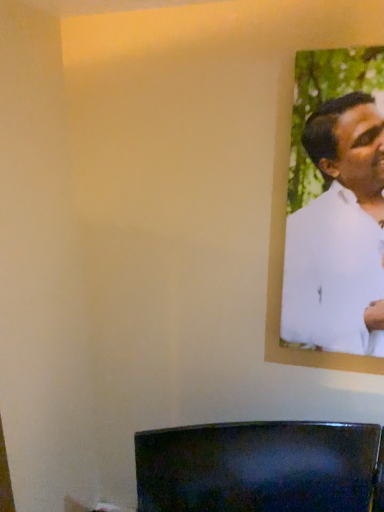
Question: Which is correct: glossy black tv at lower center is inside white matte shirt at upper right, or outside of it?

Choices:
 (A) outside
 (B) inside

Answer: (A)

Question: Based on their sizes in the image, would you say glossy black tv at lower center is bigger or smaller than white matte shirt at upper right?

Choices:
 (A) small
 (B) big

Answer: (B)

Question: Relative to white matte shirt at upper right, is glossy black tv at lower center in front or behind?

Choices:
 (A) front
 (B) behind

Answer: (B)

Question: Relative to glossy black tv at lower center, is white matte shirt at upper right in front or behind?

Choices:
 (A) front
 (B) behind

Answer: (A)

Question: In the image, is white matte shirt at upper right on the left side or the right side of glossy black tv at lower center?

Choices:
 (A) right
 (B) left

Answer: (A)

Question: Choose the correct answer: Is white matte shirt at upper right inside glossy black tv at lower center or outside it?

Choices:
 (A) inside
 (B) outside

Answer: (B)

Question: From their relative heights in the image, would you say white matte shirt at upper right is taller or shorter than glossy black tv at lower center?

Choices:
 (A) tall
 (B) short

Answer: (A)